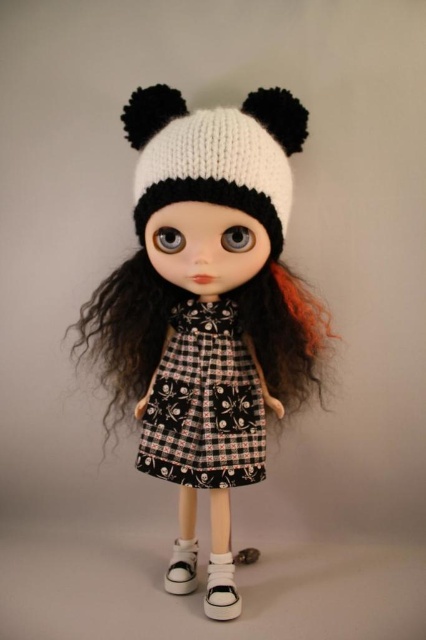
You are a fashion designer trying to create a matching accessory set for the doll. The set should include both the white knitted hat at center and the white canvas shoe at lower center. Which item would you need to scale down in size to ensure they are proportionally balanced?

The white knitted hat at center is larger in size than the white canvas shoe at lower center. To balance the proportions, the white knitted hat at center should be scaled down to match the smaller size of the white canvas shoe at lower center.

You are a fashion designer observing the doll. You need to decide whether the curly hair at center will cover the white matte shoe at lower center when viewed from the front. Based on their sizes, what do you think?

The curly hair at center is larger in size than the white matte shoe at lower center, so it is possible that the curly hair at center could cover the white matte shoe at lower center when viewed from the front.

Looking at the doll, which object is larger between the curly hair at center and the white knitted hat at upper center?

The curly hair at center is bigger than the white knitted hat at upper center.